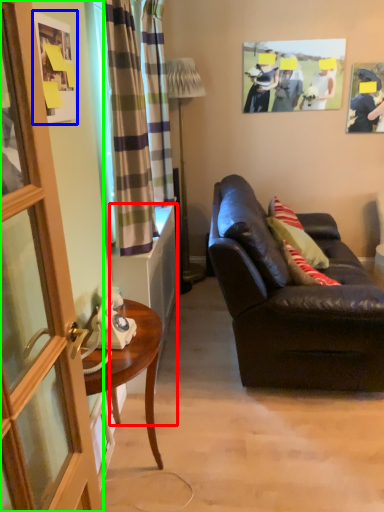
Question: Considering the real-world distances, which object is closest to cabinetry (highlighted by a red box)? picture frame (highlighted by a blue box) or screen door (highlighted by a green box).

Choices:
 (A) picture frame
 (B) screen door

Answer: (A)